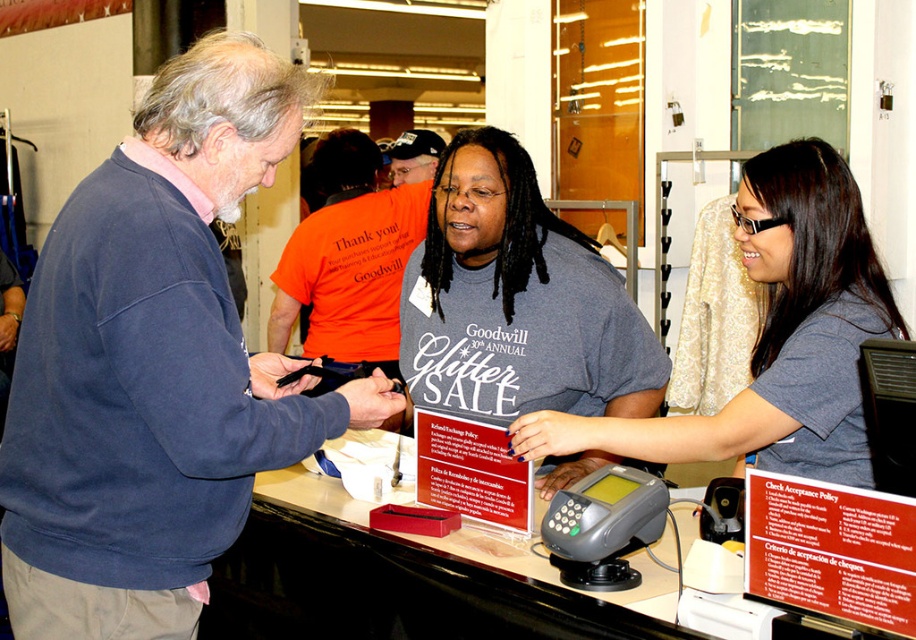
You are standing at the entrance of the Goodwill store and want to ask the person in the blue sweatshirt at left for directions. Which direction should you look to find them?

The blue sweatshirt at left is located at point 0.572 on the x axis and 0.170 on the y axis, so you should look towards the left side of the store near the entrance area.

You are standing at the checkout counter in the Goodwill store during the Glitter Sale. There is a point marked at coordinates [176,388]. Can you reach this point from your current position without moving your feet?

The point at [176,388] is 4.17 feet away from you. Since you are at the checkout counter and the distance is more than an arm length, you cannot reach it without moving your feet.

You are a customer at the Goodwill store during their Glitter Sale. You see two shirts at the checkout counter. The gray matte shirt at center and the orange cotton shirt at center. Which shirt is closer to you?

The gray matte shirt at center is positioned under the orange cotton shirt at center, meaning the orange cotton shirt at center is on top and therefore closer to you.